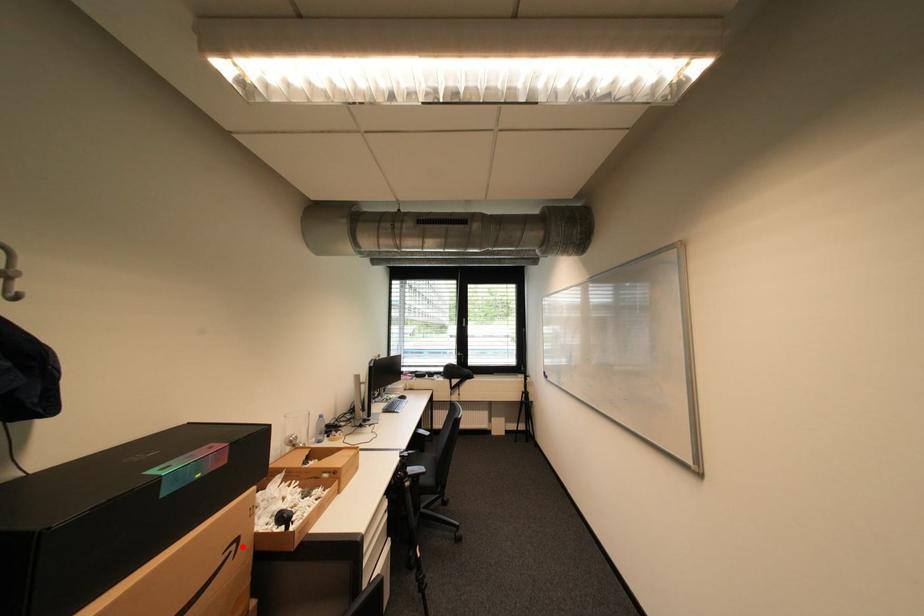
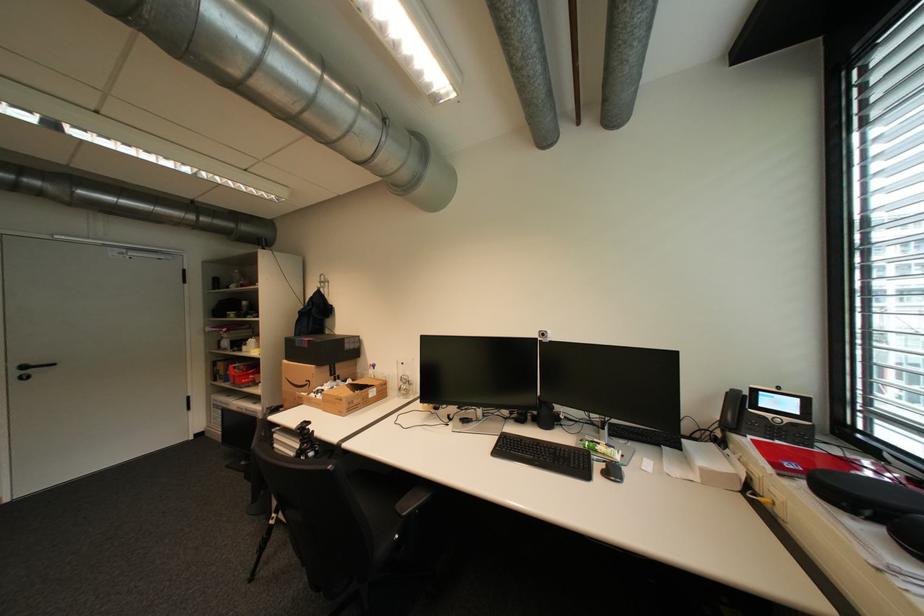
Where in the second image is the point corresponding to the highlighted location from the first image?

(317, 383)